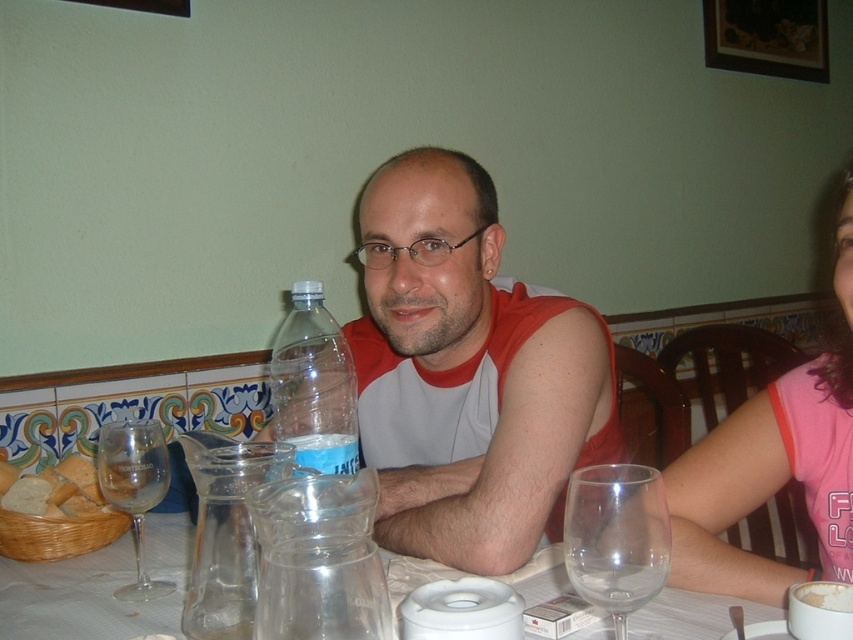
You are a customer at this dining table and want to grab the clear plastic bottle at center to drink. Is the matte plastic bottle at center blocking your path to reach it?

The matte plastic bottle at center is further to the viewer than clear plastic bottle at center, so it is blocking the path to the clear plastic bottle at center. You will need to move the matte plastic bottle at center first.

You are a photographer adjusting your camera focus. There are two points in the image you need to focus on, point (479, 474) and point (273, 381). Which point should you focus on first if you want to start with the one closer to the camera?

Point (479, 474) is closer to the viewer than point (273, 381), so you should focus on point (479, 474) first.